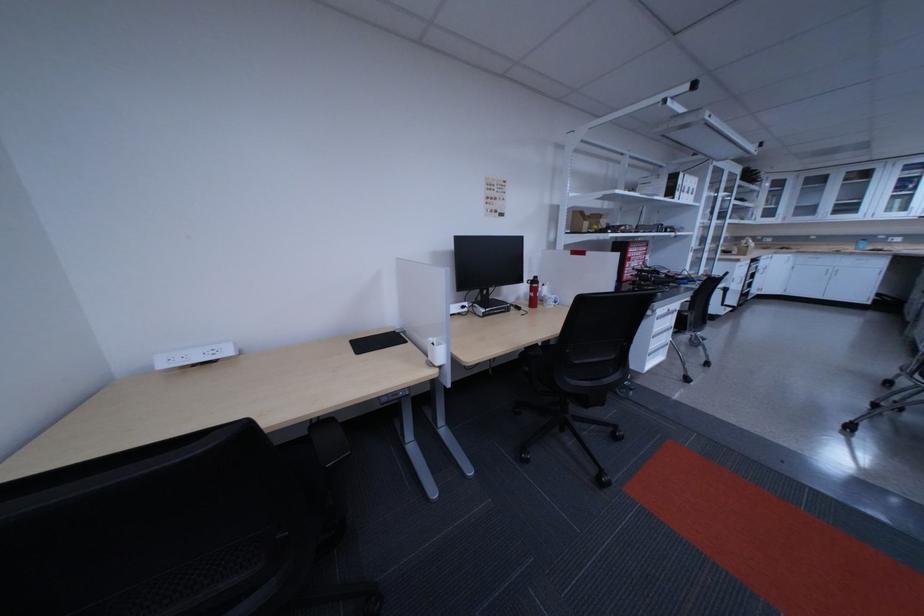
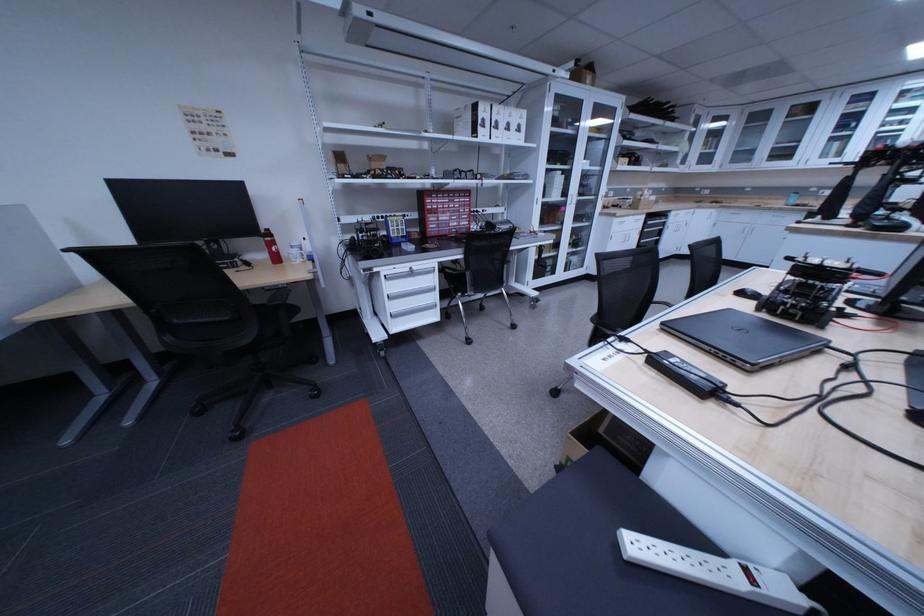
Where in the second image is the point corresponding to pixel 748 283 from the first image?

(626, 241)